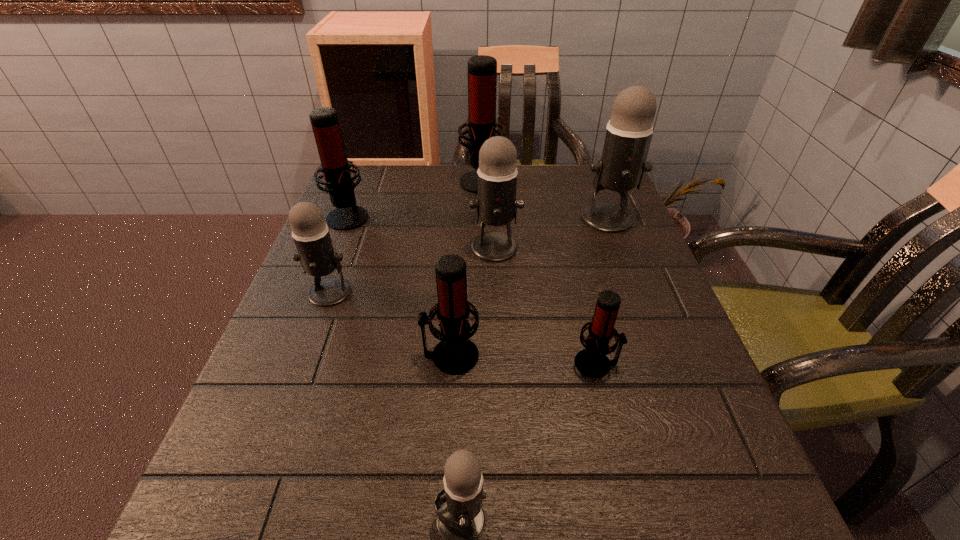
You are a GUI agent. You are given a task and a screenshot of the screen. Output one action in this format:
    pyautogui.click(x=<x>, y=<y>)
    Task: Click on the farthest red microphone
    
    Given the screenshot: What is the action you would take?
    pyautogui.click(x=482, y=70)

This screenshot has width=960, height=540. What are the coordinates of `the farthest microphone` in the screenshot? It's located at [x=482, y=70].

Where is `the biggest gray microphone`? The image size is (960, 540). the biggest gray microphone is located at coordinates (622, 165).

Find the location of `the rightmost object`. the rightmost object is located at coordinates (622, 165).

Identify the location of the leftmost red microphone. (335, 166).

Find the location of a particular element. the third smallest red microphone is located at coordinates (335, 166).

The width and height of the screenshot is (960, 540). In order to click on the third smallest gray microphone in this screenshot , I will do `click(497, 174)`.

The height and width of the screenshot is (540, 960). In order to click on the third biggest red microphone in this screenshot , I will do coord(455,354).

You are a GUI agent. You are given a task and a screenshot of the screen. Output one action in this format:
    pyautogui.click(x=<x>, y=<y>)
    Task: Click on the second smallest gray microphone
    
    Given the screenshot: What is the action you would take?
    pyautogui.click(x=316, y=254)

The width and height of the screenshot is (960, 540). Find the location of `the fourth nearest object`. the fourth nearest object is located at coordinates (316, 254).